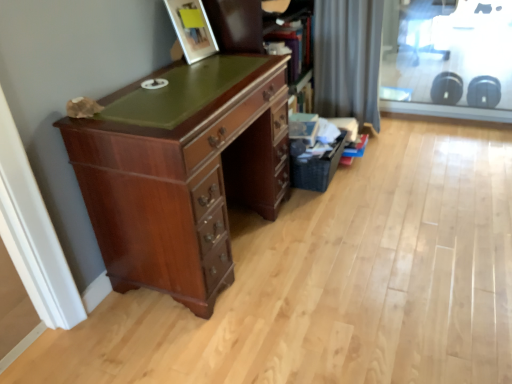
This screenshot has height=384, width=512. What are the coordinates of `free location in front of matte wood picture frame at upper center` in the screenshot? It's located at (194, 61).